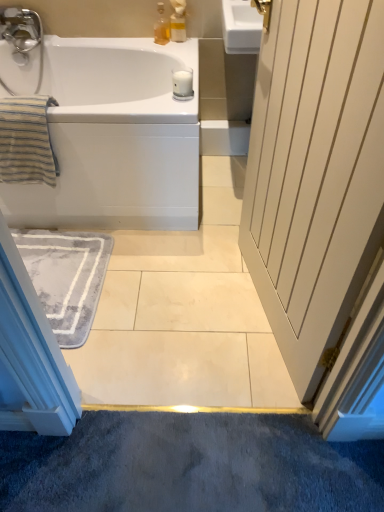
This screenshot has height=512, width=384. What are the coordinates of `free space in front of translucent plastic bottle at upper center` in the screenshot? It's located at (173, 50).